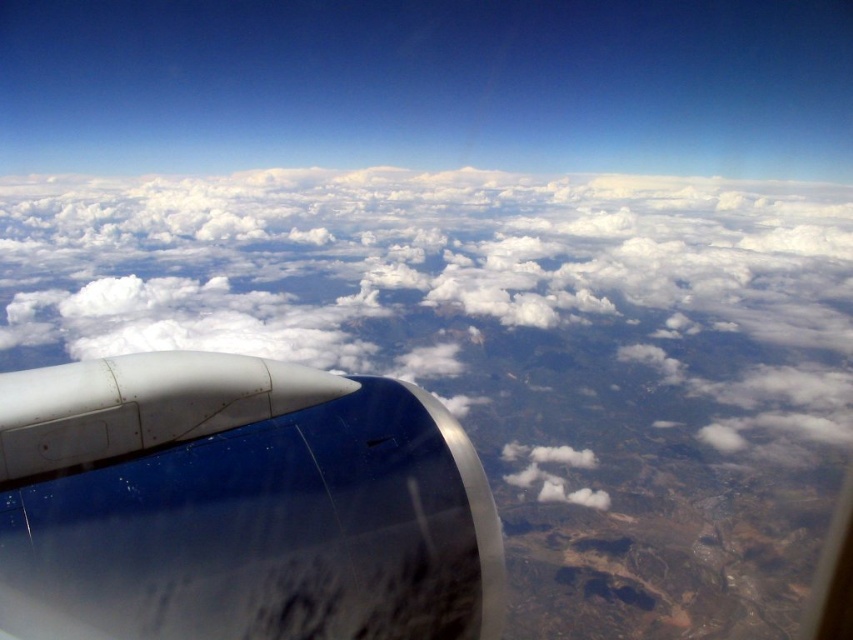
Question: Can you confirm if white fluffy cloud at center is positioned above metallic blue engine at center?

Choices:
 (A) yes
 (B) no

Answer: (A)

Question: Which object appears closest to the camera in this image?

Choices:
 (A) metallic blue engine at center
 (B) white fluffy cloud at center

Answer: (A)

Question: Which object is closer to the camera taking this photo?

Choices:
 (A) metallic blue engine at center
 (B) white fluffy cloud at center

Answer: (A)

Question: Is white fluffy cloud at center wider than metallic blue engine at center?

Choices:
 (A) yes
 (B) no

Answer: (A)

Question: From the image, what is the correct spatial relationship of white fluffy cloud at center in relation to metallic blue engine at center?

Choices:
 (A) left
 (B) right

Answer: (A)